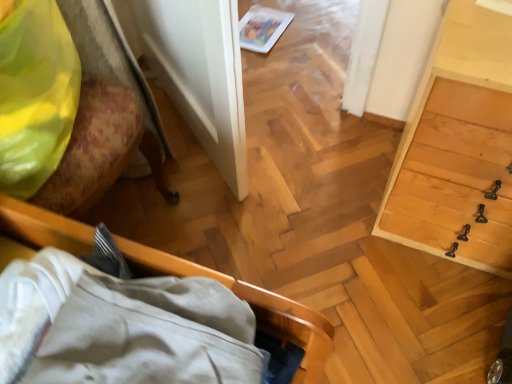
Identify the location of free space to the left of light wood dresser at right. (318, 201).